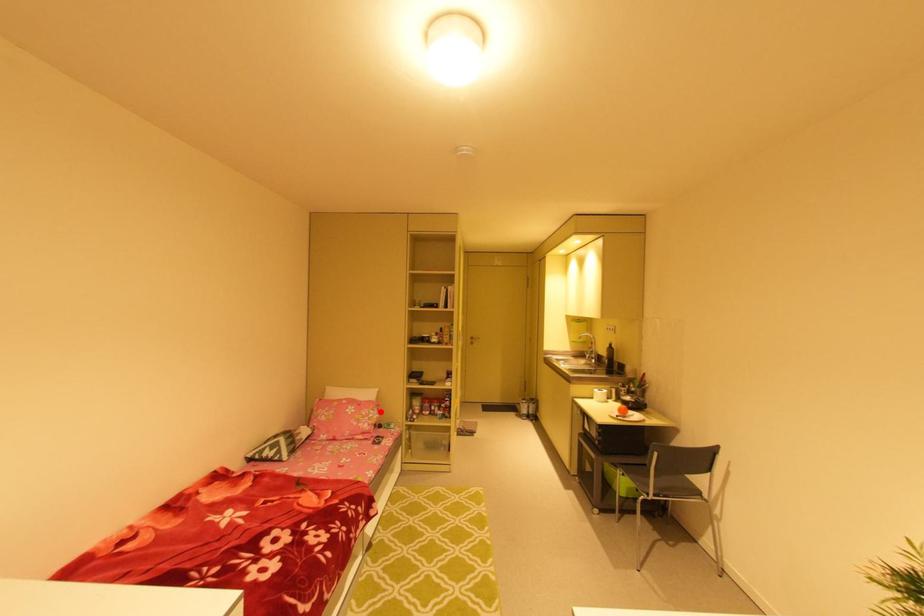
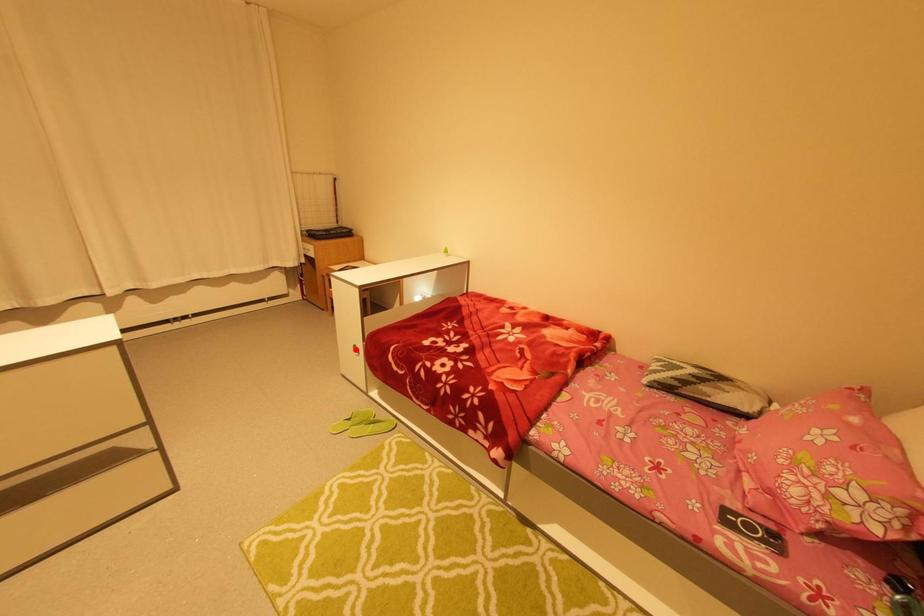
I am providing you with two images of the same scene from different viewpoints. A red point is marked on the first image and another point is marked on the second image. Do the highlighted points in image1 and image2 indicate the same real-world spot?

No